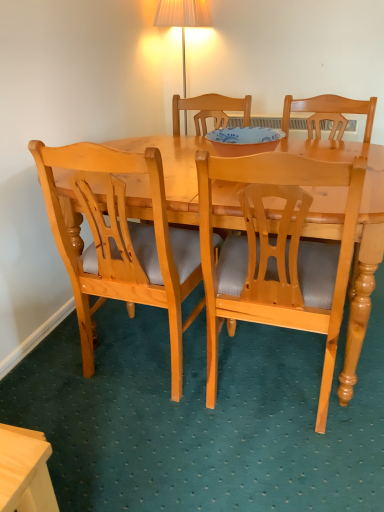
The image size is (384, 512). Describe the element at coordinates (244, 140) in the screenshot. I see `blue glossy bowl at center` at that location.

Identify the location of light brown wood chair at left, marked as the first chair in a left-to-right arrangement. (121, 242).

In order to face light brown wood chair at left, the 2th chair in the right-to-left sequence, should I rotate leftwards or rightwards?

To align with it, rotate left about 5.887°.

I want to click on blue glossy bowl at center, so click(x=244, y=140).

From the light wood desk at lower left, count 1st chairs backward and point to it. Please provide its 2D coordinates.

[(277, 254)]

Which of these two, light brown wood chair at center, which is the first chair in right-to-left order, or light wood desk at lower left, stands taller?

Standing taller between the two is light brown wood chair at center, which is the first chair in right-to-left order.

Is light brown wood chair at center, which is the first chair in right-to-left order, in front of or behind light wood desk at lower left in the image?

light brown wood chair at center, which is the first chair in right-to-left order, is positioned farther from the viewer than light wood desk at lower left.

Between light brown wood chair at center, arranged as the second chair when viewed from the left, and light wood desk at lower left, which one has smaller width?

light wood desk at lower left.

Is light wood desk at lower left in contact with blue glossy bowl at center?

light wood desk at lower left is not next to blue glossy bowl at center, and they're not touching.

Can you confirm if light wood desk at lower left is shorter than blue glossy bowl at center?

In fact, light wood desk at lower left may be taller than blue glossy bowl at center.

Looking at their sizes, would you say light wood desk at lower left is wider or thinner than blue glossy bowl at center?

light wood desk at lower left is thinner than blue glossy bowl at center.

At what (x,y) coordinates should I click in order to perform the action: click on desk below the blue glossy bowl at center (from a real-world perspective). Please return your answer as a coordinate pair (x, y). This screenshot has height=512, width=384. Looking at the image, I should click on (25, 471).

Would you say blue glossy bowl at center is a long distance from light brown wood chair at center, arranged as the second chair when viewed from the left?

No, blue glossy bowl at center is not far away from light brown wood chair at center, arranged as the second chair when viewed from the left.

Is blue glossy bowl at center positioned beyond the bounds of light brown wood chair at center, which is the first chair in right-to-left order?

blue glossy bowl at center lies outside light brown wood chair at center, which is the first chair in right-to-left order,'s area.

From the image's perspective, is blue glossy bowl at center on top of light brown wood chair at center, which is the first chair in right-to-left order?

Indeed, from the image's perspective, blue glossy bowl at center is shown above light brown wood chair at center, which is the first chair in right-to-left order.

From a real-world perspective, between light wood desk at lower left and light brown wood chair at center, arranged as the second chair when viewed from the left, who is vertically higher?

light brown wood chair at center, arranged as the second chair when viewed from the left, is physically above.

Does light wood desk at lower left contain light brown wood chair at center, which is the first chair in right-to-left order?

No, light wood desk at lower left does not contain light brown wood chair at center, which is the first chair in right-to-left order.

From the image's perspective, is light wood desk at lower left on top of light brown wood chair at center, arranged as the second chair when viewed from the left?

No, from the image's perspective, light wood desk at lower left is not on top of light brown wood chair at center, arranged as the second chair when viewed from the left.

Is light wood desk at lower left bigger or smaller than light brown wood chair at center, which is the first chair in right-to-left order?

Clearly, light wood desk at lower left is smaller in size than light brown wood chair at center, which is the first chair in right-to-left order.

Does light brown wood chair at left, the 2th chair in the right-to-left sequence, appear on the right side of light brown wood chair at center, arranged as the second chair when viewed from the left?

In fact, light brown wood chair at left, the 2th chair in the right-to-left sequence, is to the left of light brown wood chair at center, arranged as the second chair when viewed from the left.

Which is in front, point (169, 234) or point (331, 296)?

Point (331, 296)

Are light brown wood chair at left, the 2th chair in the right-to-left sequence, and light brown wood chair at center, which is the first chair in right-to-left order, beside each other?

No, light brown wood chair at left, the 2th chair in the right-to-left sequence, is not making contact with light brown wood chair at center, which is the first chair in right-to-left order.

Considering the positions of objects light brown wood chair at center, which is the first chair in right-to-left order, and light brown wood chair at left, marked as the first chair in a left-to-right arrangement, in the image provided, who is more to the right, light brown wood chair at center, which is the first chair in right-to-left order, or light brown wood chair at left, marked as the first chair in a left-to-right arrangement,?

Positioned to the right is light brown wood chair at center, which is the first chair in right-to-left order.

From a real-world perspective, is light brown wood chair at center, which is the first chair in right-to-left order, positioned above or below light brown wood chair at left, marked as the first chair in a left-to-right arrangement?

In terms of real-world spatial position, light brown wood chair at center, which is the first chair in right-to-left order, is below light brown wood chair at left, marked as the first chair in a left-to-right arrangement.

From the image's perspective, is light brown wood chair at center, which is the first chair in right-to-left order, positioned above or below light brown wood chair at left, the 2th chair in the right-to-left sequence?

light brown wood chair at center, which is the first chair in right-to-left order, is situated lower than light brown wood chair at left, the 2th chair in the right-to-left sequence, in the image.

Considering the positions of objects light brown wood chair at center, which is the first chair in right-to-left order, and light brown wood chair at left, the 2th chair in the right-to-left sequence, in the image provided, who is behind, light brown wood chair at center, which is the first chair in right-to-left order, or light brown wood chair at left, the 2th chair in the right-to-left sequence,?

light brown wood chair at left, the 2th chair in the right-to-left sequence, is further away from the camera.

From the image's perspective, who appears lower, blue glossy bowl at center or light wood desk at lower left?

light wood desk at lower left appears lower in the image.

Which is less distant, [222,139] or [26,474]?

Point [222,139] appears to be farther away from the viewer than point [26,474].

Is blue glossy bowl at center oriented towards light wood desk at lower left?

No, blue glossy bowl at center is not aimed at light wood desk at lower left.

Is blue glossy bowl at center taller or shorter than light wood desk at lower left?

In the image, blue glossy bowl at center appears to be shorter than light wood desk at lower left.

At what (x,y) coordinates should I click in order to perform the action: click on the 1st chair directly above the light wood desk at lower left (from a real-world perspective). Please return your answer as a coordinate pair (x, y). The width and height of the screenshot is (384, 512). Looking at the image, I should click on (277, 254).

You are a GUI agent. You are given a task and a screenshot of the screen. Output one action in this format:
    pyautogui.click(x=<x>, y=<y>)
    Task: Click on the bowl that appears above the light wood desk at lower left (from the image's perspective)
    Image resolution: width=384 pixels, height=512 pixels.
    Given the screenshot: What is the action you would take?
    pyautogui.click(x=244, y=140)

When comparing their distances from light wood desk at lower left, does blue glossy bowl at center or light brown wood chair at center, arranged as the second chair when viewed from the left, seem further?

Among the two, blue glossy bowl at center is located further to light wood desk at lower left.

Which object lies further to the anchor point light brown wood chair at left, the 2th chair in the right-to-left sequence, light brown wood chair at center, arranged as the second chair when viewed from the left, or blue glossy bowl at center?

blue glossy bowl at center.

Estimate the real-world distances between objects in this image. Which object is closer to light wood desk at lower left, blue glossy bowl at center or light brown wood chair at left, marked as the first chair in a left-to-right arrangement?

Among the two, light brown wood chair at left, marked as the first chair in a left-to-right arrangement, is located nearer to light wood desk at lower left.

When comparing their distances from blue glossy bowl at center, does light wood desk at lower left or light brown wood chair at center, arranged as the second chair when viewed from the left, seem further?

light wood desk at lower left is further to blue glossy bowl at center.

Considering their positions, is blue glossy bowl at center positioned further to light brown wood chair at left, the 2th chair in the right-to-left sequence, than light wood desk at lower left?

light wood desk at lower left is further to light brown wood chair at left, the 2th chair in the right-to-left sequence.

Based on their spatial positions, is light wood desk at lower left or blue glossy bowl at center further from light brown wood chair at left, marked as the first chair in a left-to-right arrangement?

Based on the image, light wood desk at lower left appears to be further to light brown wood chair at left, marked as the first chair in a left-to-right arrangement.

Looking at this image, from the image, which object appears to be farther from blue glossy bowl at center, light brown wood chair at left, the 2th chair in the right-to-left sequence, or light wood desk at lower left?

Based on the image, light wood desk at lower left appears to be further to blue glossy bowl at center.

Looking at the image, which one is located closer to light brown wood chair at center, arranged as the second chair when viewed from the left, light brown wood chair at left, the 2th chair in the right-to-left sequence, or blue glossy bowl at center?

light brown wood chair at left, the 2th chair in the right-to-left sequence, is positioned closer to the anchor light brown wood chair at center, arranged as the second chair when viewed from the left.

At what (x,y) coordinates should I click in order to perform the action: click on chair situated between light wood desk at lower left and light brown wood chair at center, which is the first chair in right-to-left order, from left to right. Please return your answer as a coordinate pair (x, y). The width and height of the screenshot is (384, 512). Looking at the image, I should click on (121, 242).

At what (x,y) coordinates should I click in order to perform the action: click on chair between light brown wood chair at center, which is the first chair in right-to-left order, and blue glossy bowl at center from front to back. Please return your answer as a coordinate pair (x, y). The image size is (384, 512). Looking at the image, I should click on (121, 242).